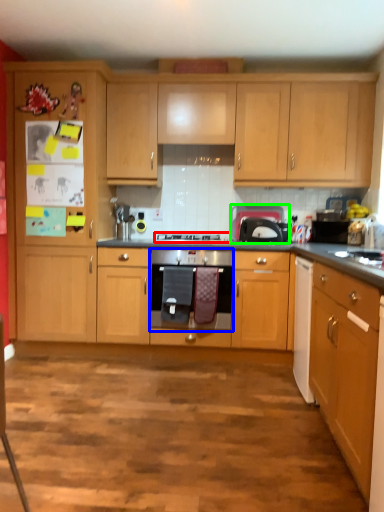
Question: Which object is positioned farthest from gas stove (highlighted by a red box)? Select from kitchen appliance (highlighted by a blue box) and appliance (highlighted by a green box).

Choices:
 (A) kitchen appliance
 (B) appliance

Answer: (A)